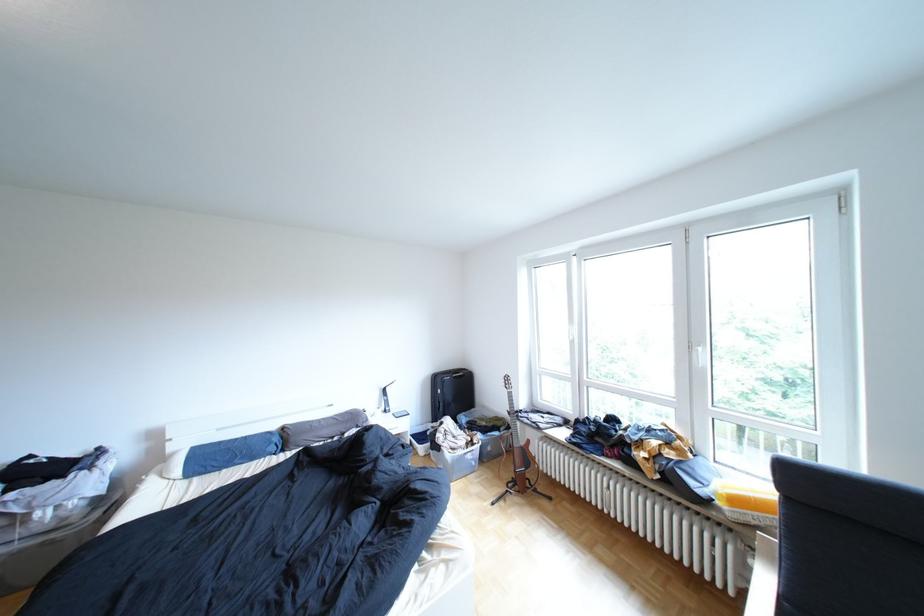
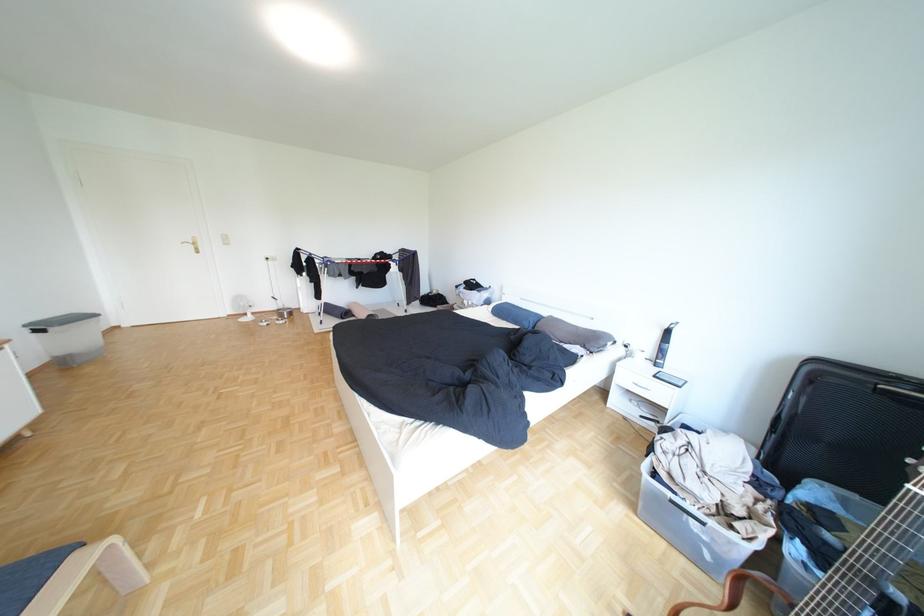
Locate, in the second image, the point that corresponds to (x=372, y=427) in the first image.

(600, 347)